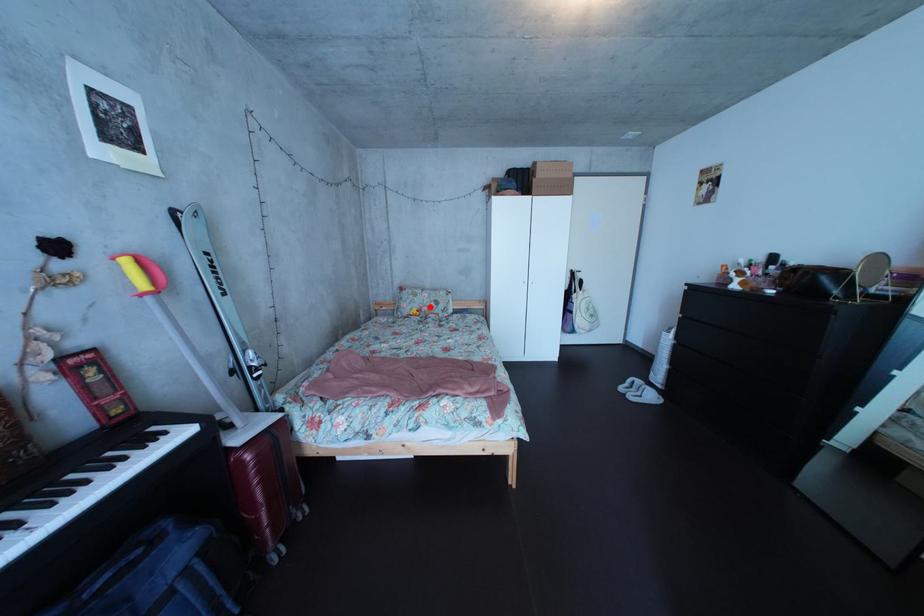
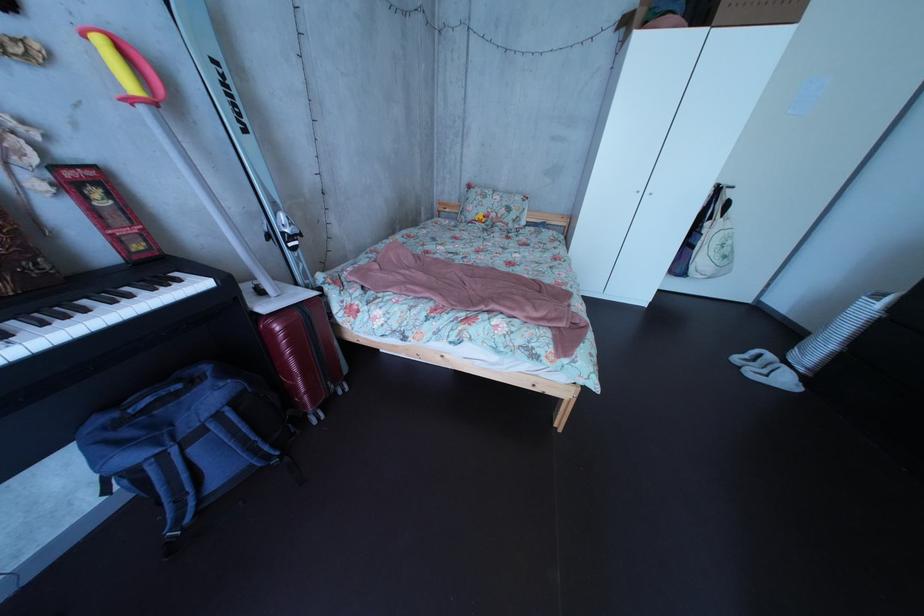
Question: A red point is marked in image1. In image2, is the corresponding 3D point closer to the camera or farther? Reply with the corresponding letter.

Choices:
 (A) The corresponding 3D point is closer.
 (B) The corresponding 3D point is farther.

Answer: (A)